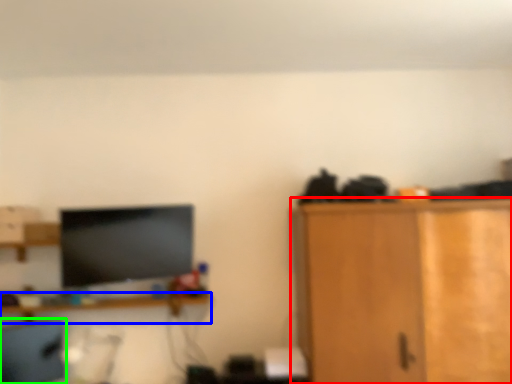
Question: Which is nearer to the cabinetry (highlighted by a red box)? shelf (highlighted by a blue box) or computer chair (highlighted by a green box).

Choices:
 (A) shelf
 (B) computer chair

Answer: (A)